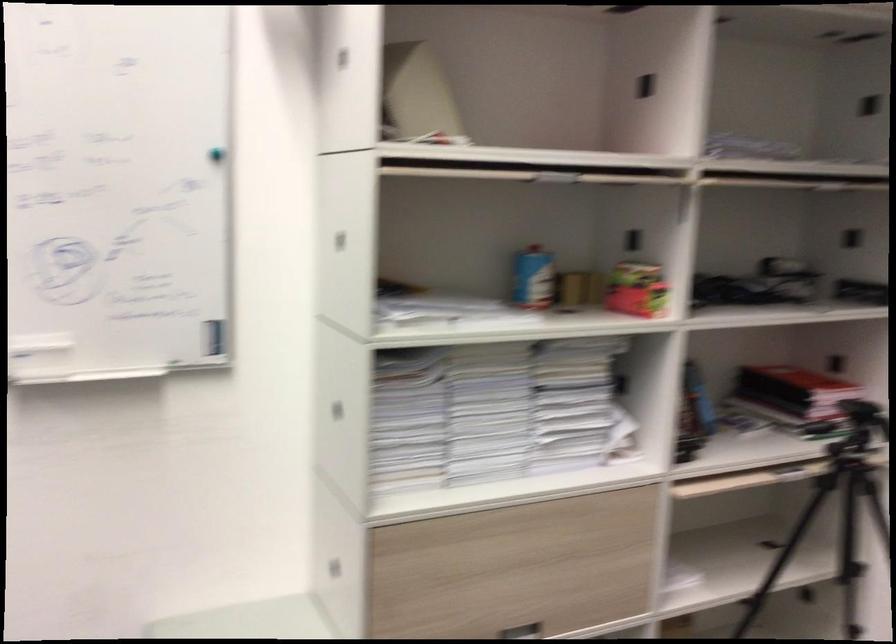
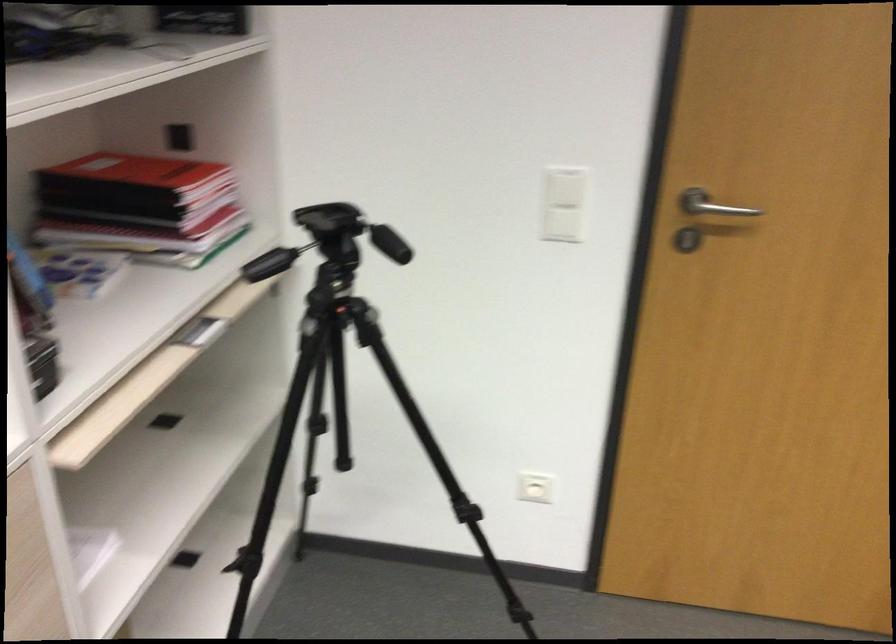
Based on the continuous images, in which direction is the camera rotating?

The camera's rotation is toward right-down.